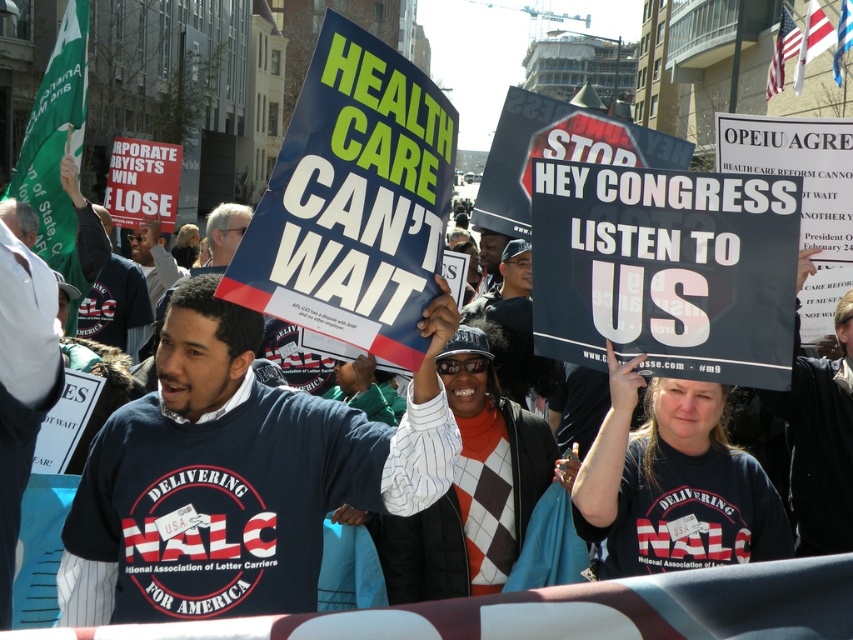
Does navy blue shirt at center have a greater height compared to dark blue shirt at center?

Yes.

Who is more distant from viewer, [448,332] or [111,333]?

Point [111,333]

At what (x,y) coordinates should I click in order to perform the action: click on navy blue shirt at center. Please return your answer as a coordinate pair (x, y). This screenshot has width=853, height=640. Looking at the image, I should click on (233, 477).